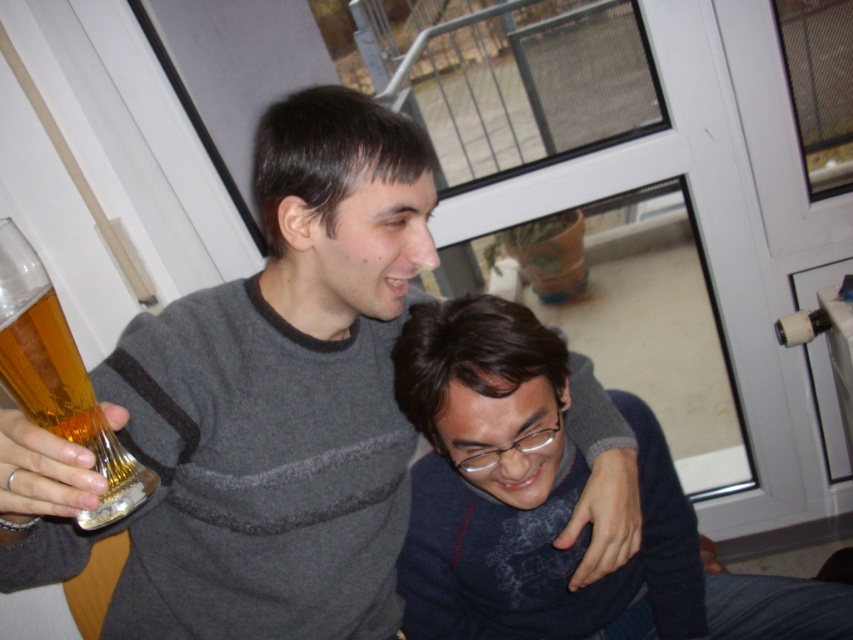
Question: Observing the image, what is the correct spatial positioning of gray striped sweater at upper center in reference to dark blue sweater at lower right?

Choices:
 (A) above
 (B) below

Answer: (A)

Question: Which object is farther from the camera taking this photo?

Choices:
 (A) dark blue sweater at lower right
 (B) translucent glass beer at left
 (C) gray striped sweater at upper center

Answer: (A)

Question: Where is gray striped sweater at upper center located in relation to dark blue sweater at lower right in the image?

Choices:
 (A) right
 (B) left

Answer: (B)

Question: Is the position of gray striped sweater at upper center less distant than that of translucent glass beer at left?

Choices:
 (A) no
 (B) yes

Answer: (B)

Question: Which point appears closest to the camera in this image?

Choices:
 (A) (465, 616)
 (B) (79, 416)
 (C) (360, 131)

Answer: (B)

Question: Which object is farther from the camera taking this photo?

Choices:
 (A) gray striped sweater at upper center
 (B) translucent glass beer at left

Answer: (B)